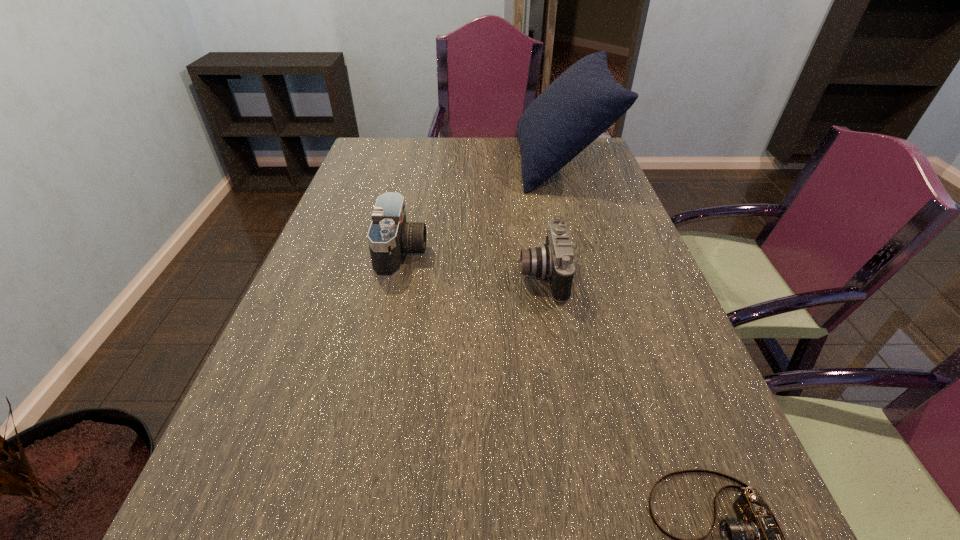
Identify the location of vacant space located 0.270m on the front-facing side of the leftmost camera. The image size is (960, 540). (530, 252).

This screenshot has height=540, width=960. Find the location of `object that is at the far edge`. object that is at the far edge is located at coordinates (584, 101).

The height and width of the screenshot is (540, 960). I want to click on object situated at the right edge, so click(584, 101).

I want to click on object situated at the far right corner, so click(584, 101).

The width and height of the screenshot is (960, 540). I want to click on vacant region at the far edge of the desktop, so click(427, 153).

Where is `vacant region at the left edge`? This screenshot has height=540, width=960. vacant region at the left edge is located at coordinates (340, 208).

This screenshot has width=960, height=540. In the image, there is a desktop. What are the coordinates of `vacant space at the right edge` in the screenshot? It's located at (647, 267).

Where is `free space at the far left corner`? free space at the far left corner is located at coordinates [x=382, y=148].

This screenshot has width=960, height=540. In order to click on vacant region at the far right corner of the desktop in this screenshot , I will do `click(598, 154)`.

Find the location of a particular element. The height and width of the screenshot is (540, 960). vacant area between the leftmost camera and the cushion is located at coordinates (481, 208).